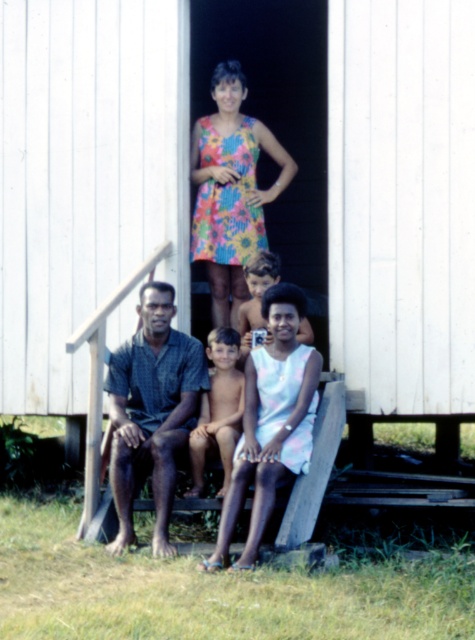
You are a photographer trying to capture a group photo. You notice the pastel floral dress at center and the white cotton shirt at lower center. Which clothing item takes up more horizontal space in the photo?

The pastel floral dress at center takes up more horizontal space in the photo because its width surpasses that of the white cotton shirt at lower center.